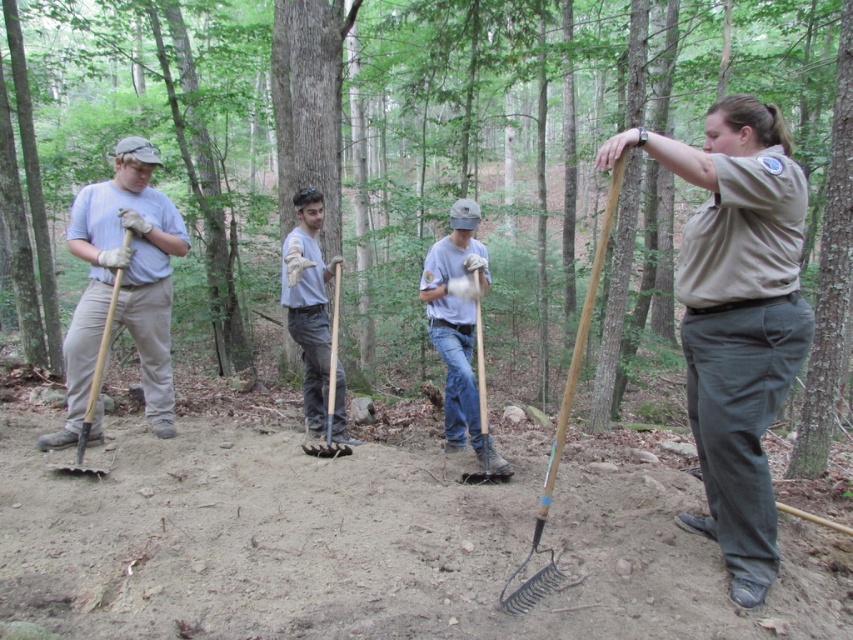
Which of these two, light gray fabric shirt at center or brushed metal shovel at left, stands taller?

With more height is light gray fabric shirt at center.

Which is above, light gray fabric shirt at center or brushed metal shovel at left?

light gray fabric shirt at center

Which is behind, point (341, 410) or point (114, 280)?

Positioned behind is point (341, 410).

At what (x,y) coordinates should I click in order to perform the action: click on light gray fabric shirt at center. Please return your answer as a coordinate pair (x, y). The width and height of the screenshot is (853, 640). Looking at the image, I should click on (308, 304).

Does brushed metal shovel at left have a greater height compared to wooden shovel at center?

Yes, brushed metal shovel at left is taller than wooden shovel at center.

Does brushed metal shovel at left appear on the left side of wooden shovel at center?

Correct, you'll find brushed metal shovel at left to the left of wooden shovel at center.

Which is behind, point (57, 467) or point (328, 429)?

Point (328, 429)

Where is `brushed metal shovel at left`? brushed metal shovel at left is located at coordinates (93, 392).

Between brushed metal shovel at left and brushed metal shovel at center, which one has more height?

brushed metal shovel at left

You are a GUI agent. You are given a task and a screenshot of the screen. Output one action in this format:
    pyautogui.click(x=<x>, y=<y>)
    Task: Click on the brushed metal shovel at left
    The width and height of the screenshot is (853, 640).
    Given the screenshot: What is the action you would take?
    pyautogui.click(x=93, y=392)